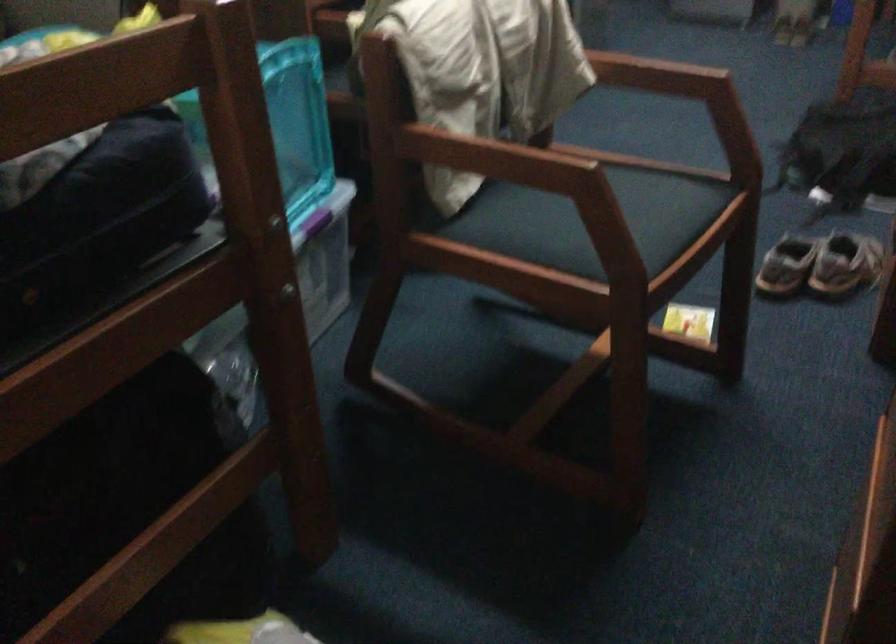
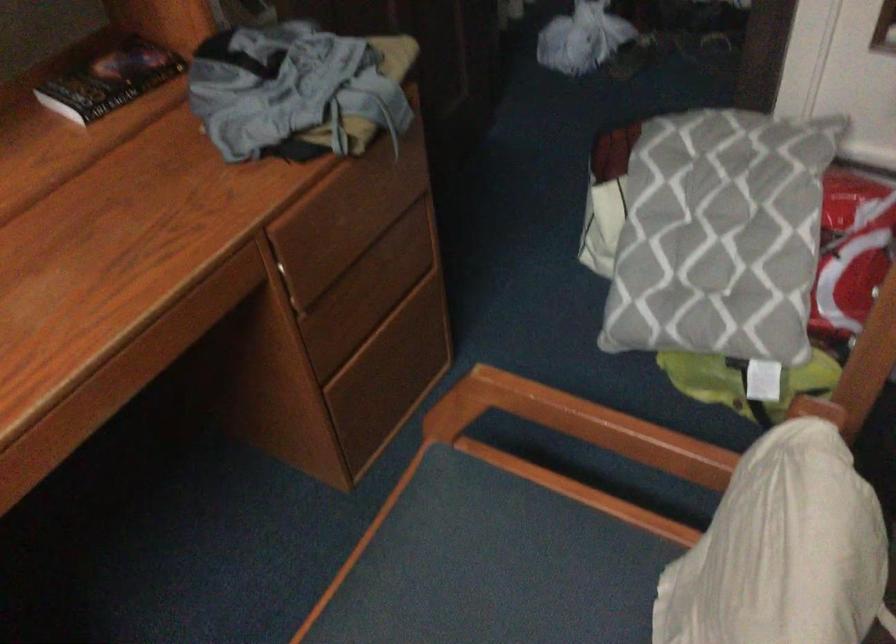
The point at (x=563, y=182) is marked in the first image. Where is the corresponding point in the second image?

(579, 424)